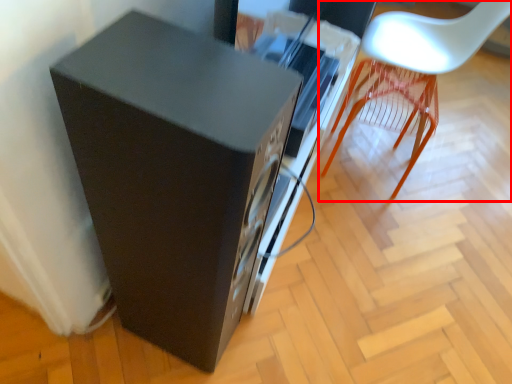
Question: Observing the image, what is the correct spatial positioning of chair (annotated by the red box) in reference to furniture?

Choices:
 (A) right
 (B) left

Answer: (A)